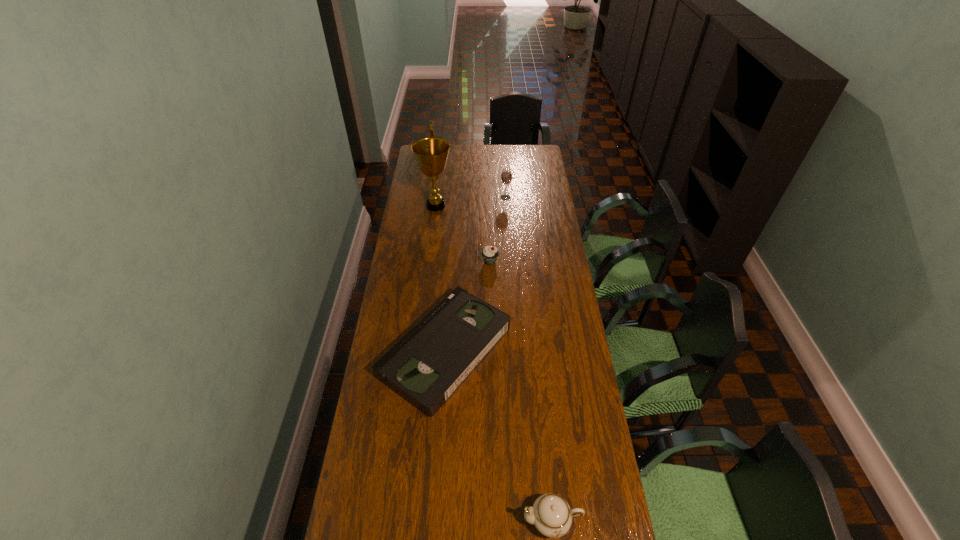
The height and width of the screenshot is (540, 960). In order to click on videotape positioned at the left edge in this screenshot , I will do `click(431, 361)`.

In the image, there is a desktop. Where is `blank space at the left edge`? blank space at the left edge is located at coordinates (396, 335).

Find the location of a particular element. The image size is (960, 540). vacant region at the right edge of the desktop is located at coordinates (583, 350).

In the image, there is a desktop. At what (x,y) coordinates should I click in order to perform the action: click on vacant space at the far right corner. Please return your answer as a coordinate pair (x, y). The height and width of the screenshot is (540, 960). Looking at the image, I should click on (521, 164).

What are the coordinates of `unoccupied area between the tallest object and the shortest object` in the screenshot? It's located at (441, 278).

Locate an element on the screen. vacant space that's between the fourth shortest object and the tallest object is located at coordinates (470, 201).

Where is `free spot between the third farthest object and the award`? The image size is (960, 540). free spot between the third farthest object and the award is located at coordinates (463, 234).

Find the location of `free spot between the award and the wineglass`. free spot between the award and the wineglass is located at coordinates (470, 201).

Identify the location of vacant area that lies between the videotape and the wineglass. (475, 274).

This screenshot has width=960, height=540. Identify the location of free space between the tallest object and the third farthest object. (463, 234).